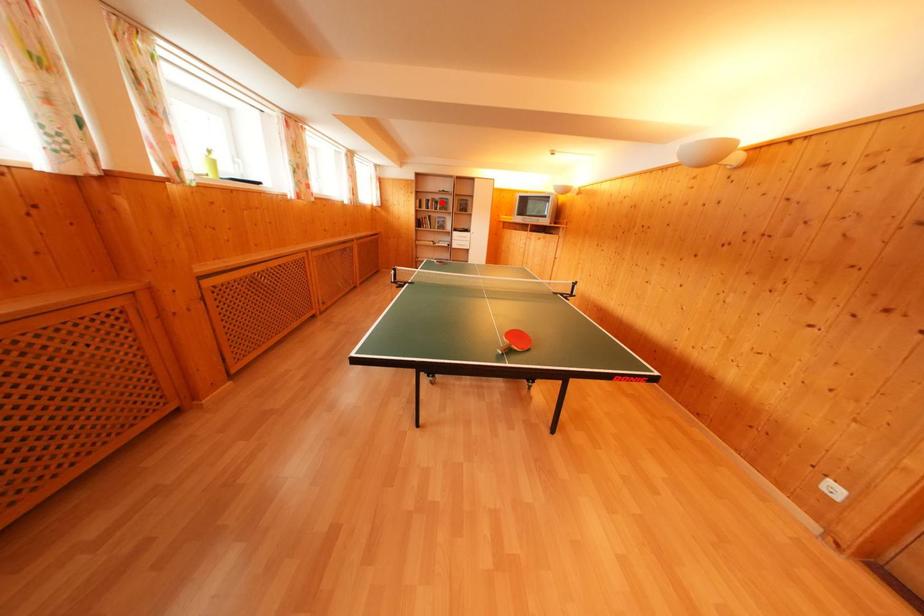
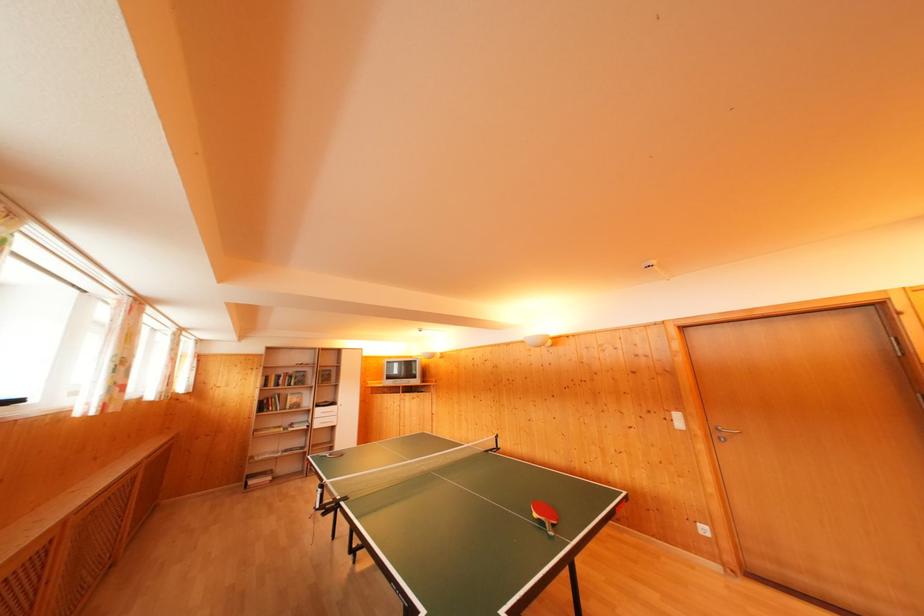
Question: A red point is marked in image1. In image2, is the corresponding 3D point closer to the camera or farther? Reply with the corresponding letter.

Choices:
 (A) The corresponding 3D point is closer.
 (B) The corresponding 3D point is farther.

Answer: (B)